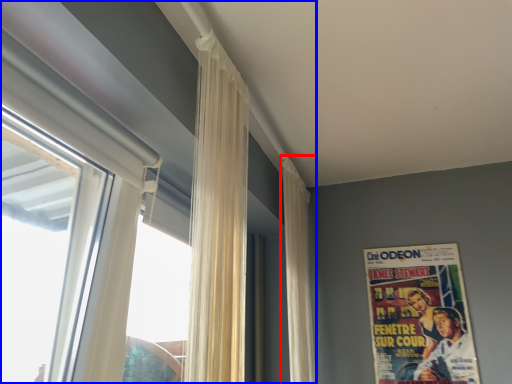
Question: Which point is closer to the camera, curtain (highlighted by a red box) or window (highlighted by a blue box)?

Choices:
 (A) curtain
 (B) window

Answer: (B)